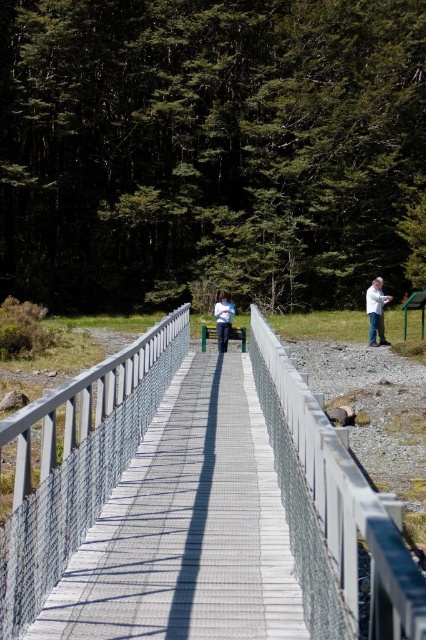
Question: Where is metal mesh bridge at center located in relation to white matte shirt at right in the image?

Choices:
 (A) above
 (B) below

Answer: (B)

Question: Which point is closer to the camera?

Choices:
 (A) (227, 321)
 (B) (374, 336)

Answer: (A)

Question: Does white matte shirt at right have a smaller size compared to light blue fabric jacket at center?

Choices:
 (A) yes
 (B) no

Answer: (A)

Question: Which point is closer to the camera taking this photo?

Choices:
 (A) (380, 282)
 (B) (132, 388)
 (C) (224, 324)

Answer: (B)

Question: Is metal mesh bridge at center wider than light blue fabric jacket at center?

Choices:
 (A) yes
 (B) no

Answer: (A)

Question: Which object is the closest to the white matte shirt at right?

Choices:
 (A) metal mesh bridge at center
 (B) light blue fabric jacket at center

Answer: (B)